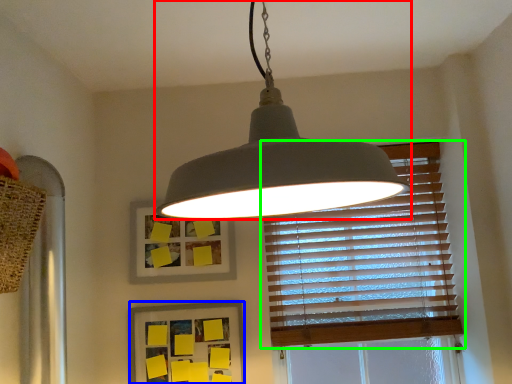
Question: Which object is positioned closest to lamp (highlighted by a red box)? Select from picture frame (highlighted by a blue box) and window blind (highlighted by a green box).

Choices:
 (A) picture frame
 (B) window blind

Answer: (B)